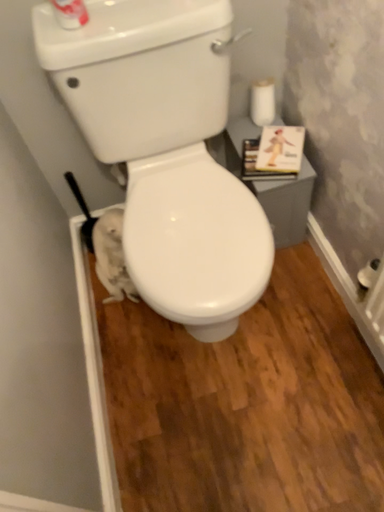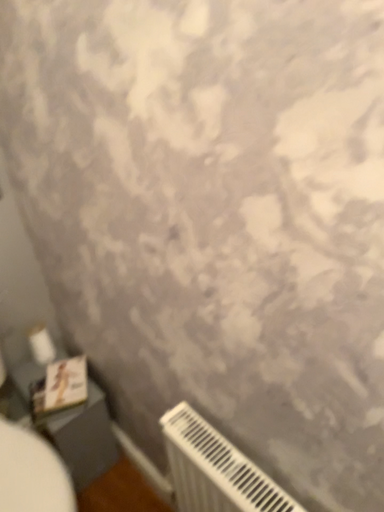
Question: Which way did the camera rotate in the video?

Choices:
 (A) rotated downward
 (B) rotated upward

Answer: (B)